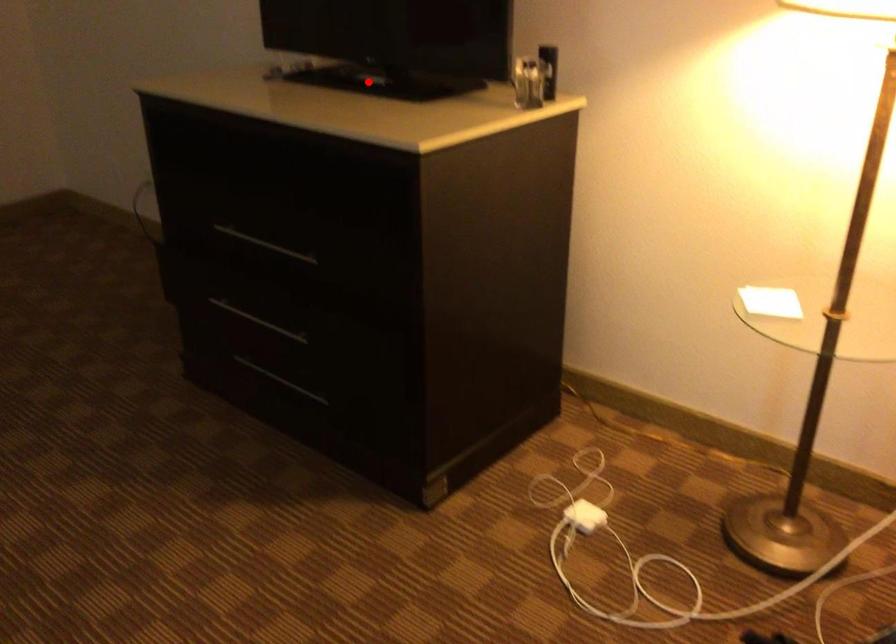
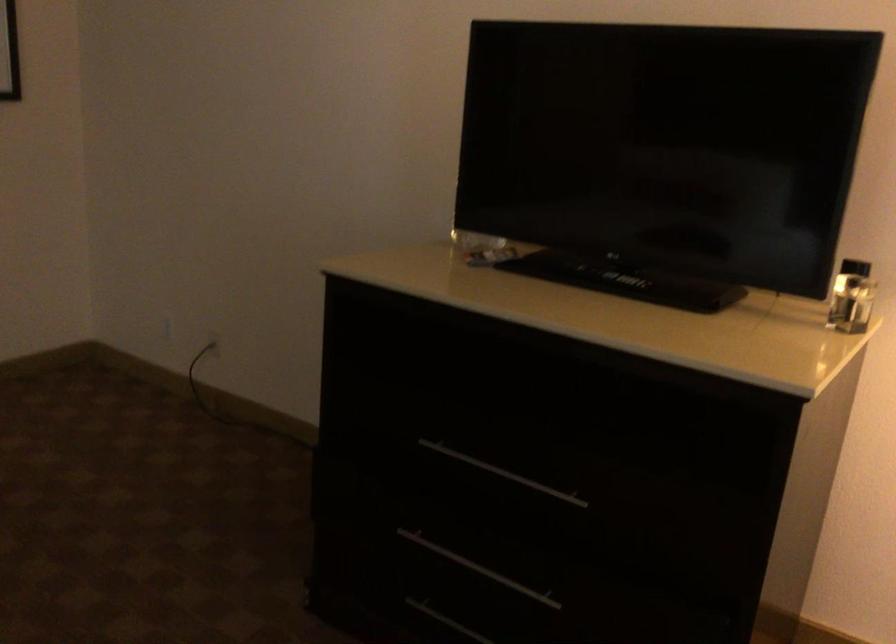
Find the pixel in the second image that matches the highlighted location in the first image.

(625, 279)